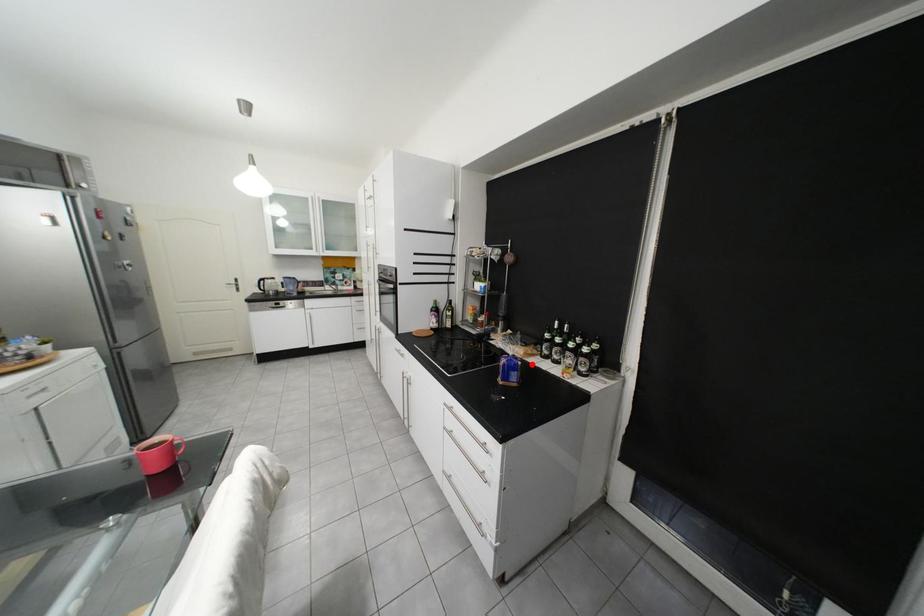
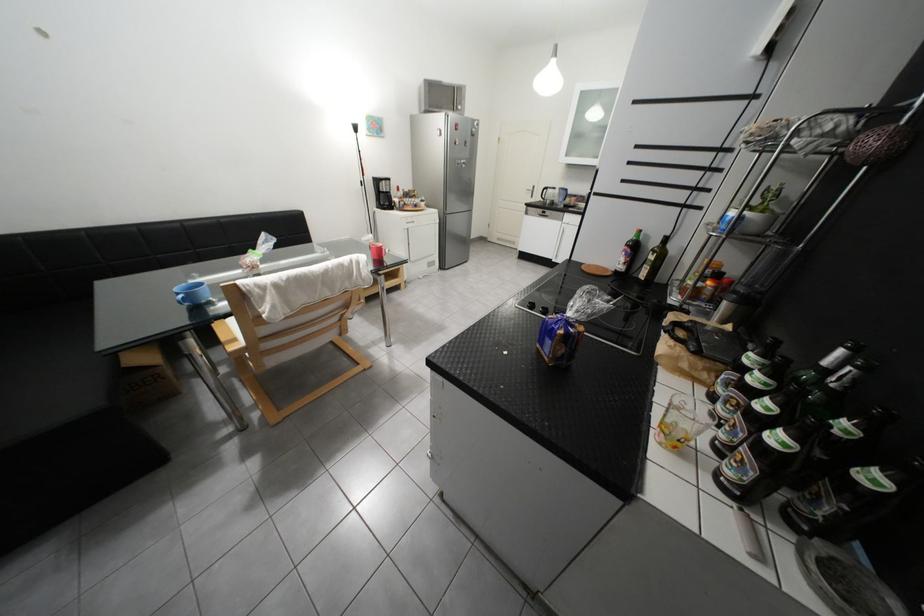
Locate, in the second image, the point that corresponds to the highlighted location in the first image.

(574, 333)